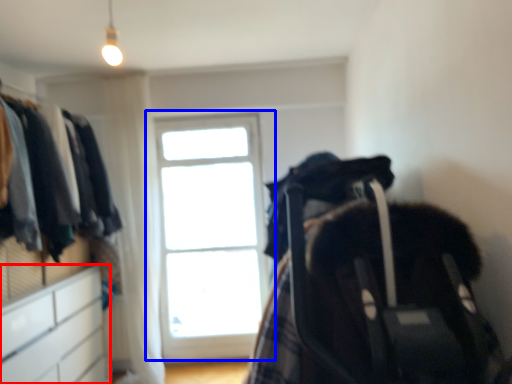
Question: Which object is closer to the camera taking this photo, file cabinet (highlighted by a red box) or window (highlighted by a blue box)?

Choices:
 (A) file cabinet
 (B) window

Answer: (A)